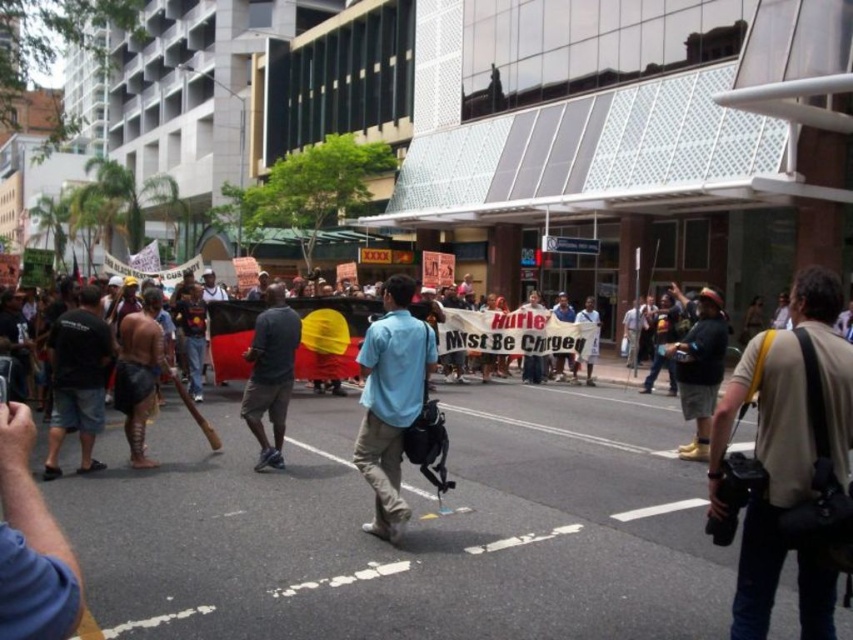
You are a photographer standing at the center of the scene. You want to take a photo of both point (265, 401) and point (659, 368). Which point is closer to you?

Point (265, 401) is closer to the viewer than point (659, 368).

You are a drone operator tasked with capturing aerial footage of the protest. Your drone has a minimum safe operating distance of 10 meters to avoid interference. Given the distance between the dark gray fabric at center and the dark brown leather jacket at center, can your drone safely fly between them without violating the safety guidelines?

The distance between the dark gray fabric at center and the dark brown leather jacket at center is 9.35 meters, which is less than the required 10 meters minimum safe operating distance. Therefore, the drone cannot safely fly between them without violating the safety guidelines.